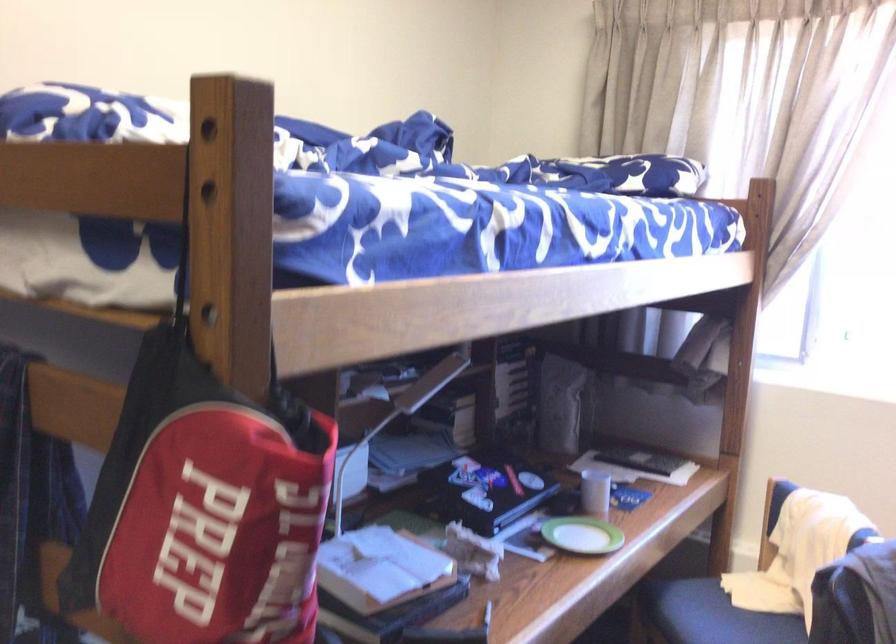
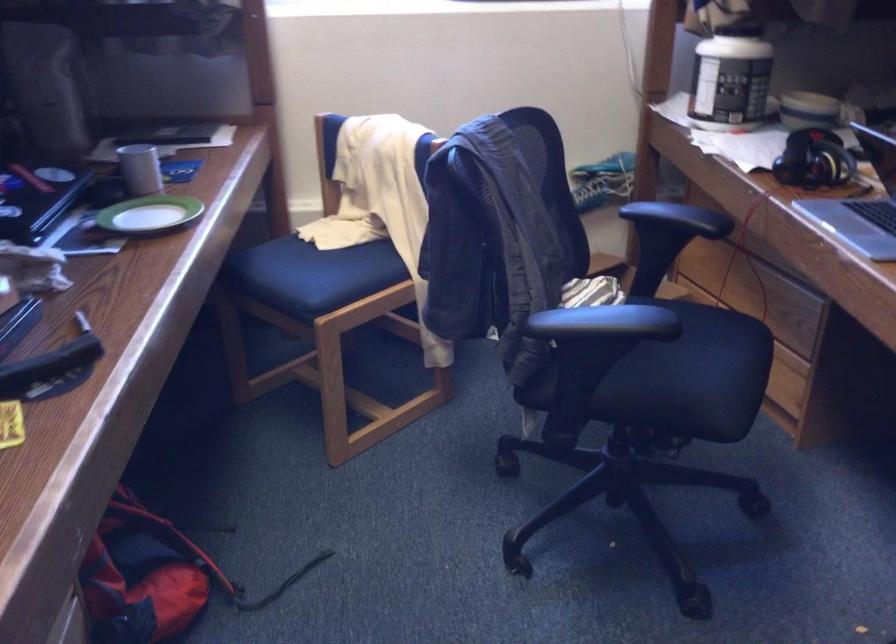
Based on the continuous images, in which direction is the camera rotating?

The rotation direction of the camera is right-down.